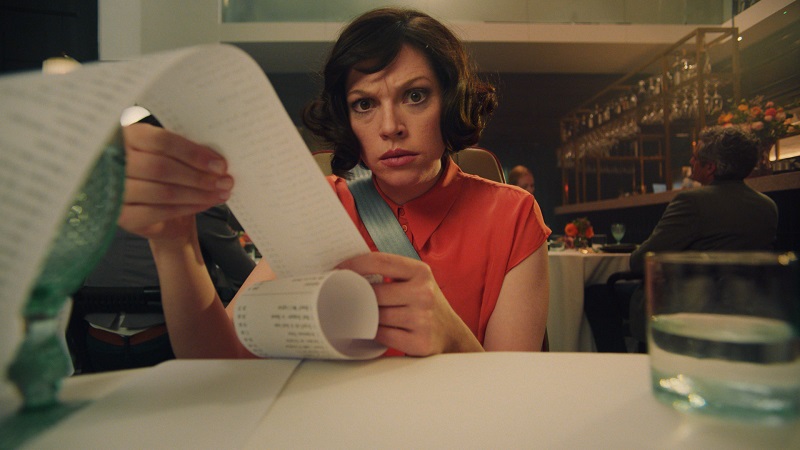
Identify the location of glass. This screenshot has width=800, height=450. (682, 357).